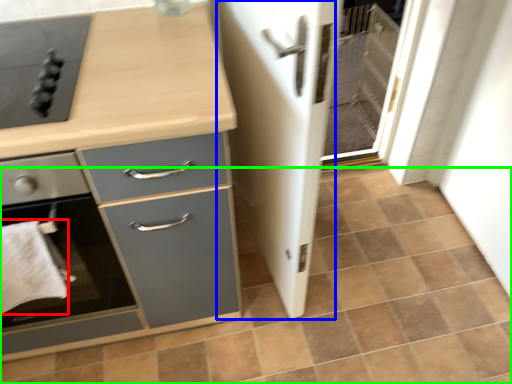
Question: Which object is positioned closest to hand towel (highlighted by a red box)? Select from screen door (highlighted by a blue box) and tile (highlighted by a green box).

Choices:
 (A) screen door
 (B) tile

Answer: (A)